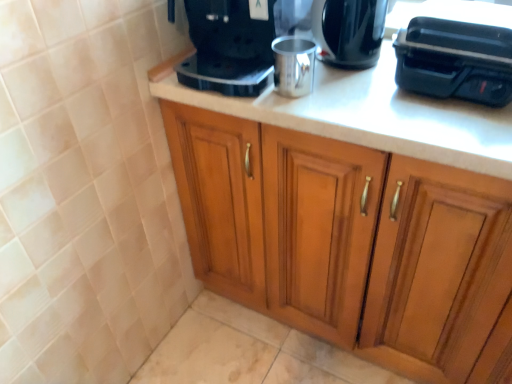
Image resolution: width=512 pixels, height=384 pixels. Identify the location of blank area to the left of silver metallic cup at center, positioned as the second appliance in right-to-left order. (229, 90).